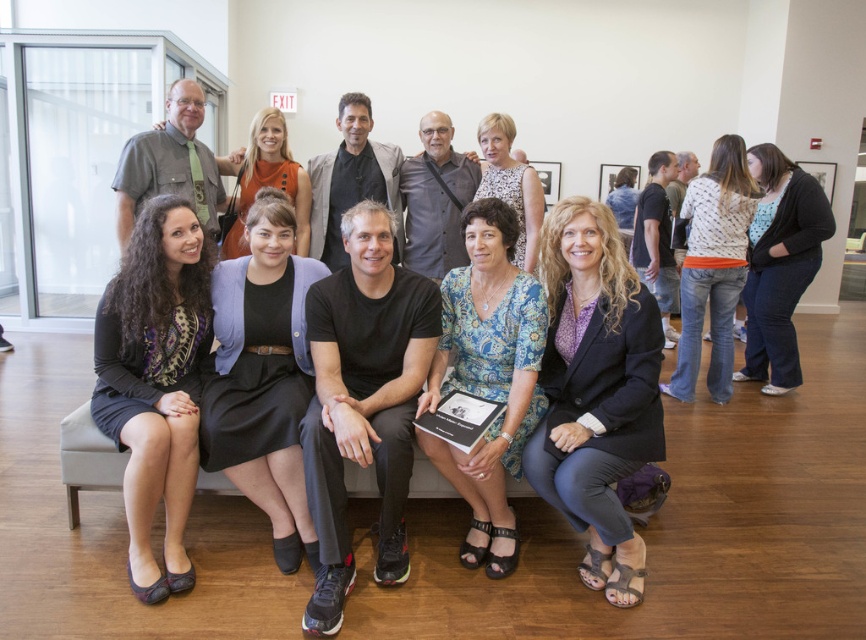
Question: Does blue patterned blouse at center lie behind matte black dress at lower left?

Choices:
 (A) no
 (B) yes

Answer: (A)

Question: Estimate the real-world distances between objects in this image. Which object is farther from the black fabric dress at center?

Choices:
 (A) matte orange dress at upper center
 (B) patterned fabric dress at center

Answer: (B)

Question: Is patterned fabric dress at center positioned in front of blonde hair at center?

Choices:
 (A) yes
 (B) no

Answer: (A)

Question: Can you confirm if matte black dress at lower left is thinner than blonde hair at center?

Choices:
 (A) yes
 (B) no

Answer: (A)

Question: Considering the real-world distances, which object is closest to the blonde hair at center?

Choices:
 (A) blue patterned blouse at center
 (B) matte orange dress at upper center

Answer: (B)

Question: Which of the following is the farthest from the observer?

Choices:
 (A) printed floral dress at center
 (B) patterned fabric dress at center

Answer: (B)